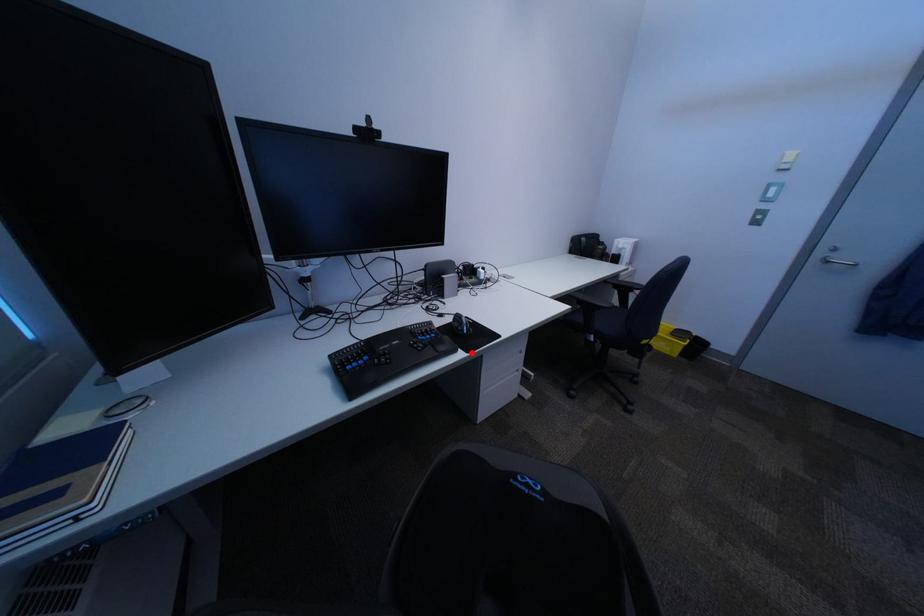
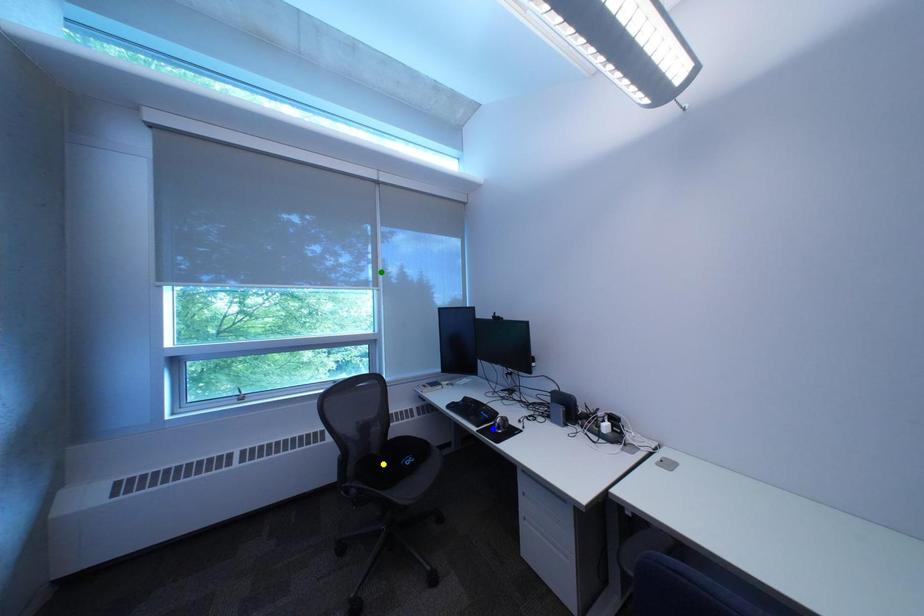
Question: I am providing you with two images of the same scene from different viewpoints. A red point is marked on the first image. You are given multiple points on the second image. In image 2, which mark is for the same physical point as the one in image 1?

Choices:
 (A) blue point
 (B) green point
 (C) yellow point

Answer: (A)